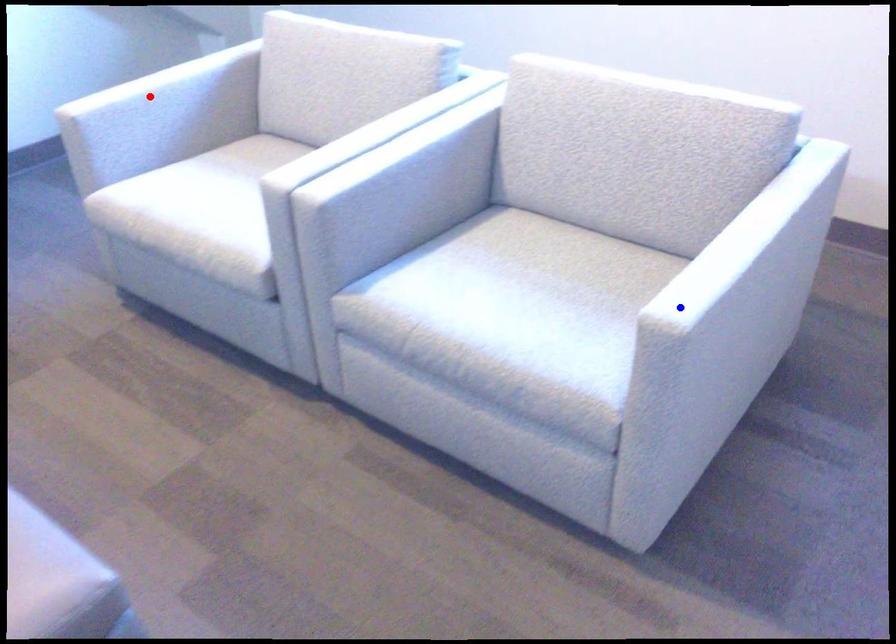
Question: In the image, two points are highlighted. Which point is nearer to the camera? Reply with the corresponding letter.

Choices:
 (A) blue point
 (B) red point

Answer: (A)